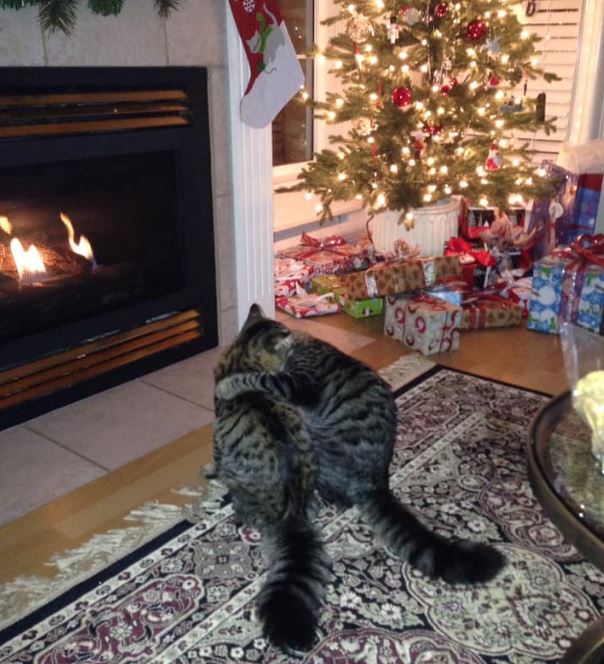
Find the location of `window`. window is located at coordinates (284, 143).